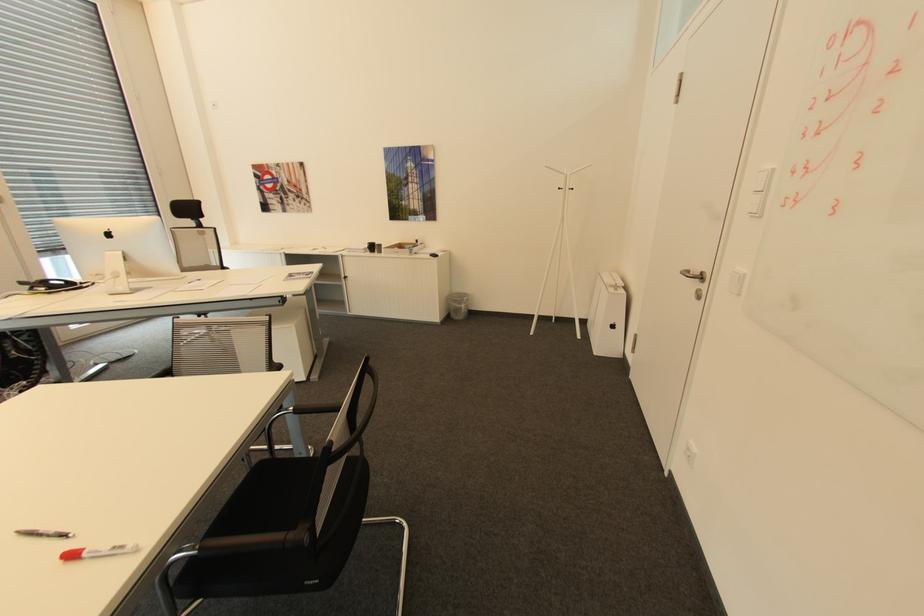
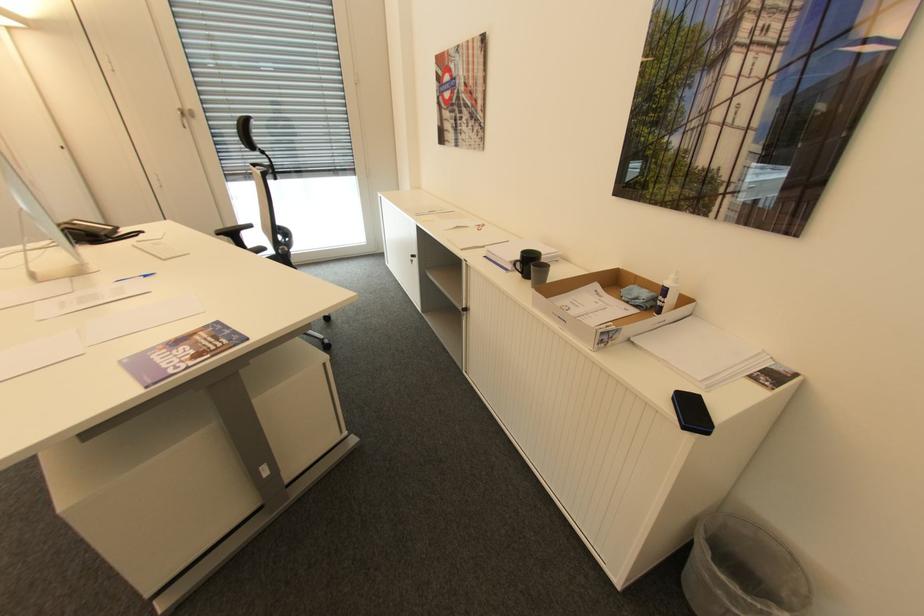
The point at [203,280] is marked in the first image. Where is the corresponding point in the second image?

(150, 276)